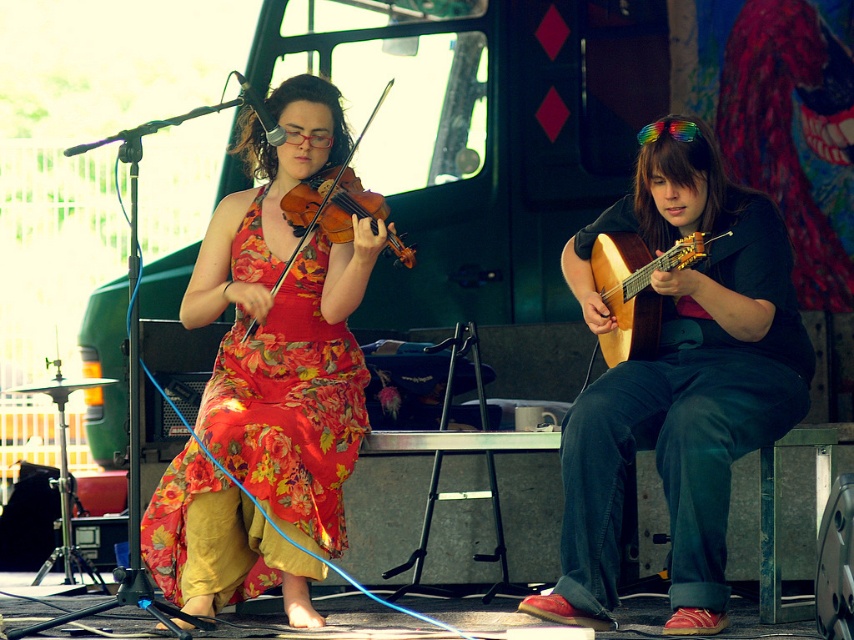
Question: Which point is closer to the camera taking this photo?

Choices:
 (A) (335, 538)
 (B) (658, 404)
 (C) (352, 148)

Answer: (B)

Question: Which point appears farthest from the camera in this image?

Choices:
 (A) (301, 237)
 (B) (617, 321)

Answer: (A)

Question: Does floral fabric dress at center appear on the left side of wooden acoustic guitar at right?

Choices:
 (A) no
 (B) yes

Answer: (B)

Question: Where is wooden acoustic guitar at right located in relation to matte wood violin at center in the image?

Choices:
 (A) below
 (B) above

Answer: (A)

Question: Which of the following is the closest to the observer?

Choices:
 (A) matte black guitar at center
 (B) matte wood violin at center

Answer: (A)

Question: In this image, where is floral fabric dress at center located relative to wooden acoustic guitar at right?

Choices:
 (A) above
 (B) below

Answer: (B)